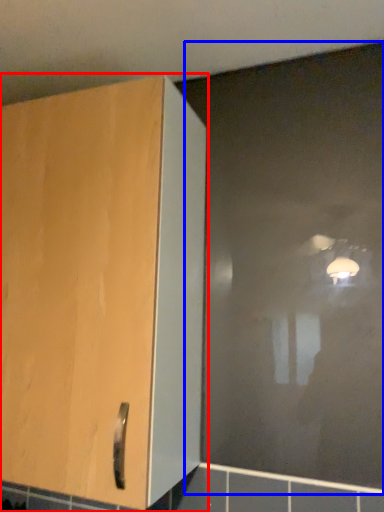
Question: Which point is closer to the camera, cupboard (highlighted by a red box) or glass door (highlighted by a blue box)?

Choices:
 (A) cupboard
 (B) glass door

Answer: (A)